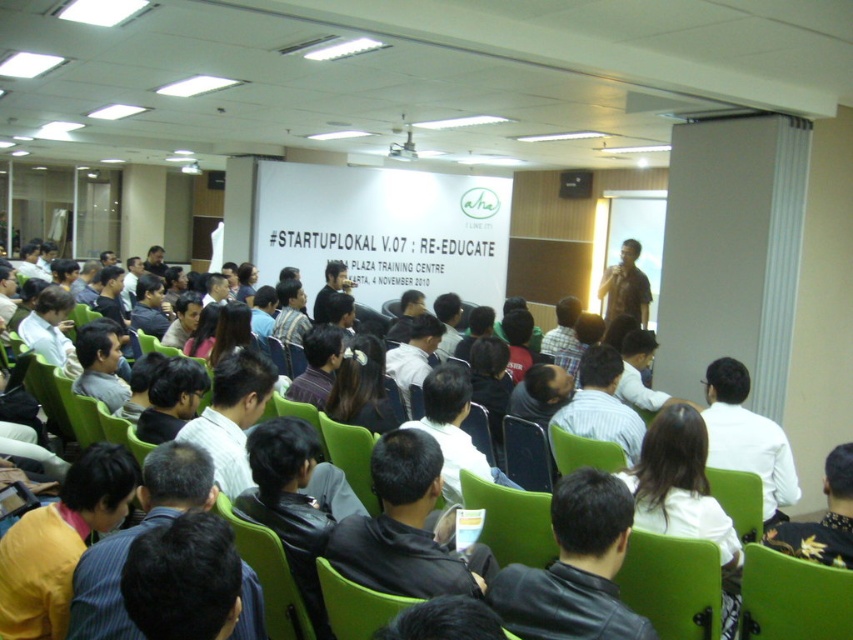
Consider the image. Between black leather jacket at lower center and green fabric chair at lower right, which one appears on the right side from the viewer's perspective?

Positioned to the right is green fabric chair at lower right.

Is black leather jacket at lower center to the right of green fabric chair at lower right from the viewer's perspective?

In fact, black leather jacket at lower center is to the left of green fabric chair at lower right.

Locate an element on the screen. black leather jacket at lower center is located at coordinates (575, 568).

In order to click on black leather jacket at lower center in this screenshot , I will do `click(575, 568)`.

Is black hair at center behind matte white shirt at center?

No, black hair at center is in front of matte white shirt at center.

Image resolution: width=853 pixels, height=640 pixels. Identify the location of black hair at center. (361, 387).

Find the location of a particular element. black hair at center is located at coordinates (361, 387).

Which of these two, black leather jacket at lower center or black leather jacket at lower right, stands taller?

With more height is black leather jacket at lower center.

What do you see at coordinates (575, 568) in the screenshot? The width and height of the screenshot is (853, 640). I see `black leather jacket at lower center` at bounding box center [575, 568].

Between point (601, 509) and point (775, 544), which one is positioned behind?

The point (775, 544) is behind.

In order to click on black leather jacket at lower center in this screenshot , I will do `click(575, 568)`.